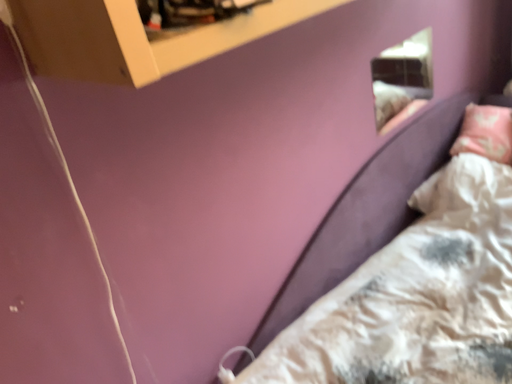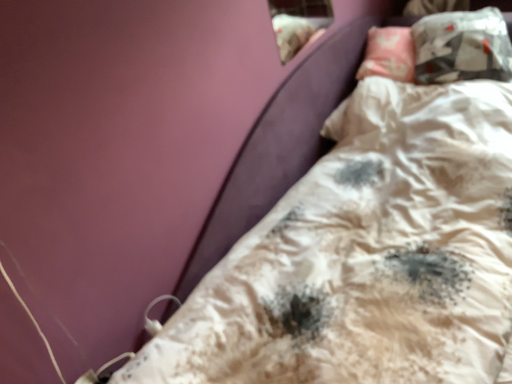
Question: Which way did the camera rotate in the video?

Choices:
 (A) rotated right
 (B) rotated left

Answer: (A)